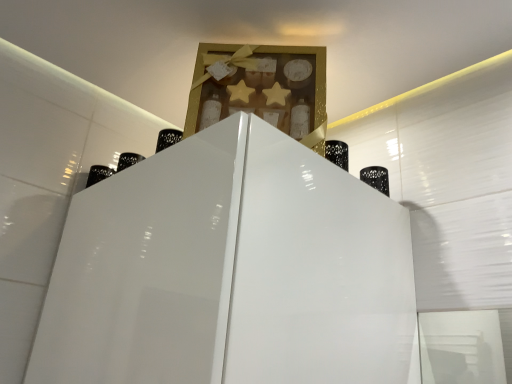
Question: Is point [387, 188] positioned closer to the camera than point [315, 140]?

Choices:
 (A) farther
 (B) closer

Answer: (A)

Question: Considering the positions of black matte bottle at right and gold textured box at upper center in the image, is black matte bottle at right bigger or smaller than gold textured box at upper center?

Choices:
 (A) big
 (B) small

Answer: (B)

Question: In terms of height, does black matte bottle at right look taller or shorter compared to gold textured box at upper center?

Choices:
 (A) tall
 (B) short

Answer: (B)

Question: From the image's perspective, is gold textured box at upper center above or below black matte bottle at right?

Choices:
 (A) below
 (B) above

Answer: (B)

Question: From a real-world perspective, is gold textured box at upper center physically located above or below black matte bottle at right?

Choices:
 (A) below
 (B) above

Answer: (B)

Question: Does point (210, 56) appear closer or farther from the camera than point (380, 172)?

Choices:
 (A) closer
 (B) farther

Answer: (A)

Question: Considering the positions of gold textured box at upper center and black matte bottle at right in the image, is gold textured box at upper center bigger or smaller than black matte bottle at right?

Choices:
 (A) big
 (B) small

Answer: (A)